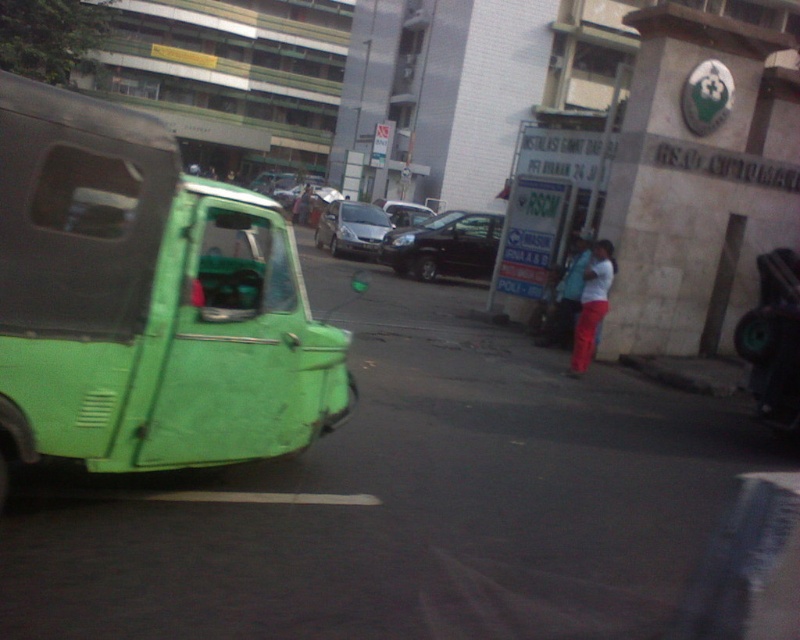
Which of these two, satin silver car at center or blue fabric jacket at center, stands taller?

With more height is satin silver car at center.

Is satin silver car at center positioned before blue fabric jacket at center?

No, satin silver car at center is further to the viewer.

You are a GUI agent. You are given a task and a screenshot of the screen. Output one action in this format:
    pyautogui.click(x=<x>, y=<y>)
    Task: Click on the satin silver car at center
    
    Given the screenshot: What is the action you would take?
    pyautogui.click(x=352, y=228)

Measure the distance between point (x=470, y=221) and camera.

Point (x=470, y=221) and camera are 72.63 feet apart.

Can you confirm if shiny black car at center is smaller than white matte shirt at center?

Yes, shiny black car at center is smaller than white matte shirt at center.

The height and width of the screenshot is (640, 800). Find the location of `shiny black car at center`. shiny black car at center is located at coordinates (444, 244).

Can you confirm if white matte shirt at center is positioned above blue fabric jacket at center?

No, white matte shirt at center is not above blue fabric jacket at center.

Is white matte shirt at center shorter than blue fabric jacket at center?

No, white matte shirt at center is not shorter than blue fabric jacket at center.

Image resolution: width=800 pixels, height=640 pixels. Describe the element at coordinates (592, 305) in the screenshot. I see `white matte shirt at center` at that location.

I want to click on white matte shirt at center, so click(x=592, y=305).